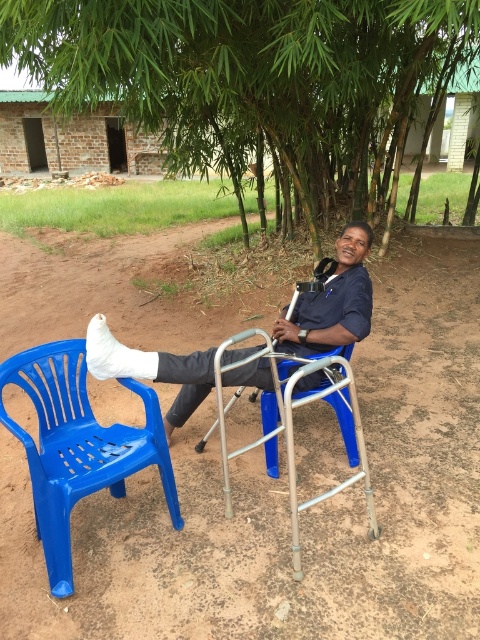
Which is below, dirt field at center or green bamboo at center?

dirt field at center

Image resolution: width=480 pixels, height=640 pixels. What are the coordinates of `dirt field at center` in the screenshot? It's located at (288, 506).

Identify the location of dirt field at center. Image resolution: width=480 pixels, height=640 pixels. (288, 506).

Is dirt field at center taller than white cast leg at center?

No.

Find the location of `dirt field at center`. dirt field at center is located at coordinates (288, 506).

You are a GUI agent. You are given a task and a screenshot of the screen. Output one action in this format:
    pyautogui.click(x=<x>, y=<y>)
    Task: Click on the dirt field at center
    This screenshot has height=640, width=480.
    Given the screenshot: What is the action you would take?
    pyautogui.click(x=288, y=506)

Between green bamboo at center and white cast leg at center, which one has more height?

green bamboo at center is taller.

Does green bamboo at center appear on the left side of white cast leg at center?

No, green bamboo at center is not to the left of white cast leg at center.

The image size is (480, 640). Identify the location of green bamboo at center. (241, 72).

What are the coordinates of `green bamboo at center` in the screenshot? It's located at (241, 72).